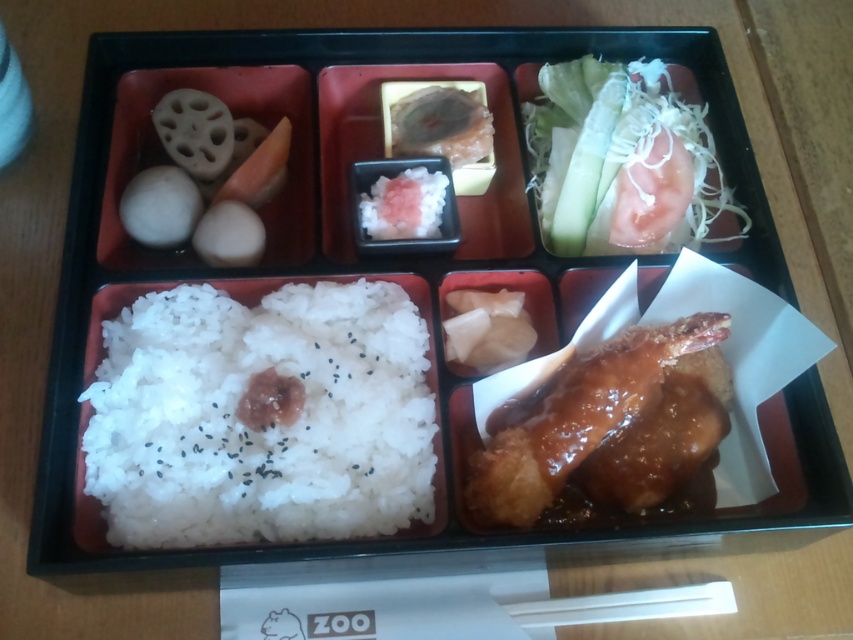
Consider the image. You are a food critic analyzing the bento box. You notice the white shredded vegetable at upper right and the white rice at center. Which of these two items has a greater height in their respective compartments?

The white shredded vegetable at upper right is much taller than the white rice at center.

You are a food photographer who needs to capture a closeup shot of the white matte rice at center. Your camera is set to a focal length of 50mm. Based on the distance between the camera and the rice, can you determine if this focal length is suitable for capturing the rice without distortion?

The white matte rice at center and camera are 91.24 centimeters apart from each other. A 50mm focal length is typically considered a standard lens, which is ideal for capturing subjects at this distance without significant distortion. Therefore, the 50mm focal length should work well for the closeup shot.

You are a food critic standing 50 inches away from the bento box. You want to examine the glossy brown chicken at bottom right closely. Is it within your reach to touch it without moving closer?

The glossy brown chicken at bottom right is 37.49 inches from the viewer. Since you are standing 50 inches away, it is farther than your reach, so you cannot touch it without moving closer.